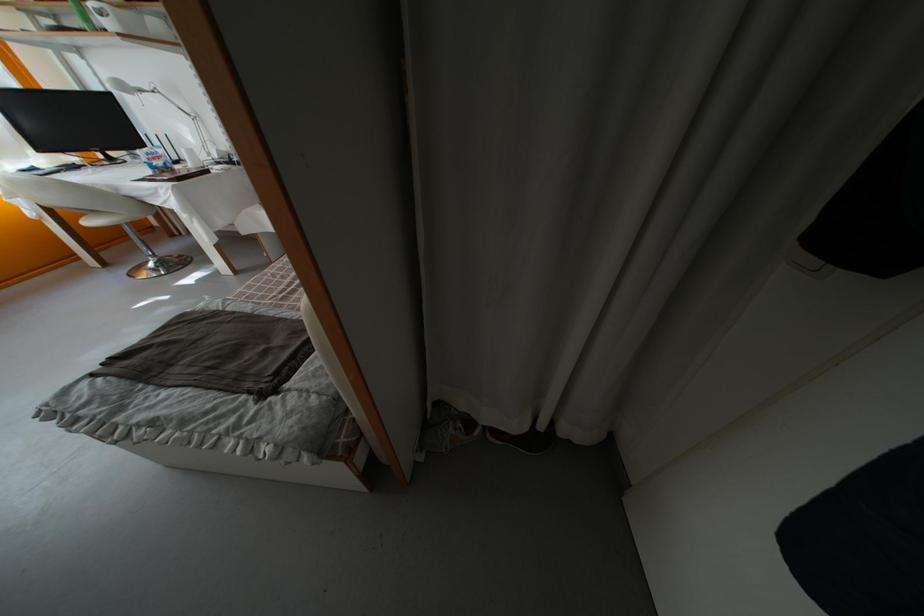
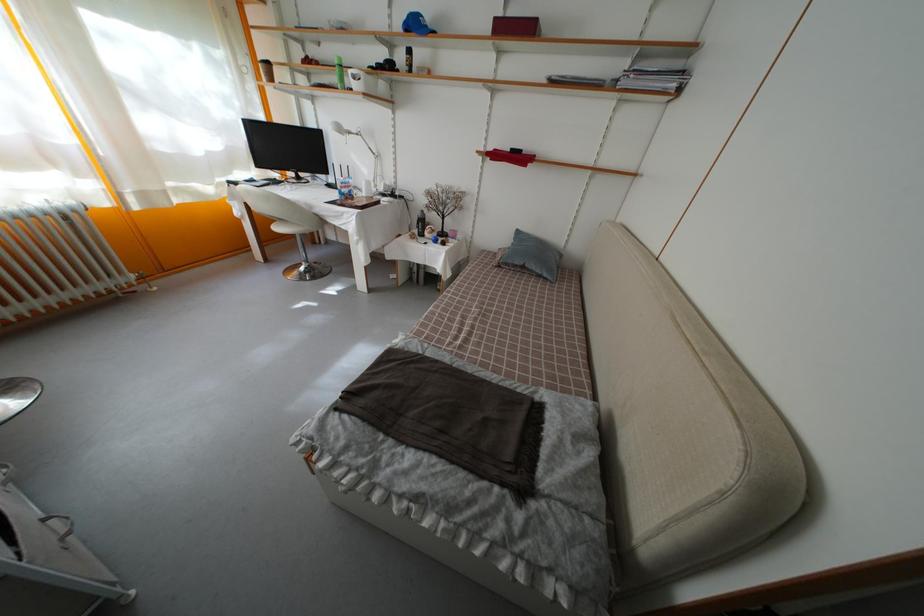
Question: The images are taken continuously from a first-person perspective. In which direction is your viewpoint rotating?

Choices:
 (A) Left
 (B) Right
 (C) Up
 (D) Down

Answer: (A)